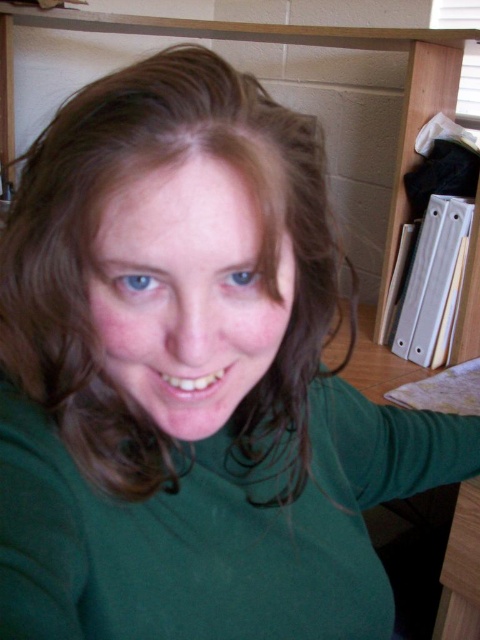
Question: Is blue matte eye at center smaller than blue iridescent eye at center?

Choices:
 (A) no
 (B) yes

Answer: (A)

Question: Is blue matte eye at center wider than blue iridescent eye at center?

Choices:
 (A) yes
 (B) no

Answer: (A)

Question: Which of the following is the farthest from the observer?

Choices:
 (A) (245, 269)
 (B) (162, 285)

Answer: (A)

Question: Does blue matte eye at center come in front of blue iridescent eye at center?

Choices:
 (A) yes
 (B) no

Answer: (A)

Question: Among these objects, which one is nearest to the camera?

Choices:
 (A) blue iridescent eye at center
 (B) blue matte eye at center

Answer: (B)

Question: Which point is closer to the camera?

Choices:
 (A) (242, 284)
 (B) (132, 289)

Answer: (B)